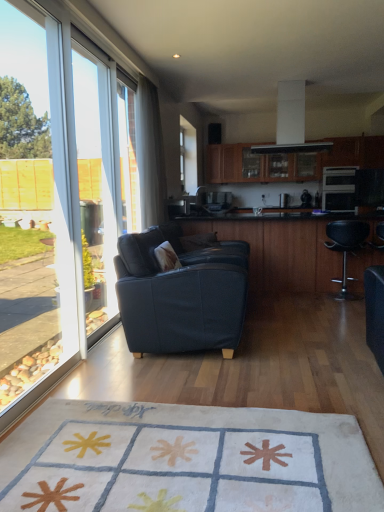
Question: Is transparent glass window at left inside or outside of white glossy exhaust hood at upper center?

Choices:
 (A) inside
 (B) outside

Answer: (B)

Question: Does point (74, 291) appear closer or farther from the camera than point (291, 104)?

Choices:
 (A) farther
 (B) closer

Answer: (B)

Question: Which is nearer to the black leather bar stool at right?

Choices:
 (A) transparent glass window at left
 (B) matte black oven at right
 (C) white glossy exhaust hood at upper center
 (D) wooden cabinet at upper center
 (E) white sheer curtain at left

Answer: (B)

Question: Which is farther from the black leather bar stool at right?

Choices:
 (A) dark blue fabric couch at center
 (B) black glossy table at center
 (C) wooden cabinet at upper center
 (D) transparent glass window screen at left
 (E) white soft rug at center

Answer: (E)